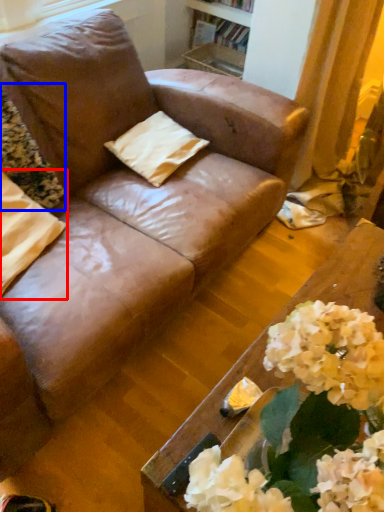
Question: Which object appears closest to the camera in this image, pillow (highlighted by a red box) or flower (highlighted by a blue box)?

Choices:
 (A) pillow
 (B) flower

Answer: (A)